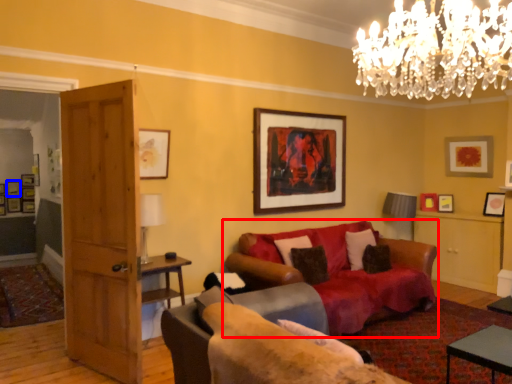
Question: Among these objects, which one is nearest to the camera, studio couch (highlighted by a red box) or picture frame (highlighted by a blue box)?

Choices:
 (A) studio couch
 (B) picture frame

Answer: (A)